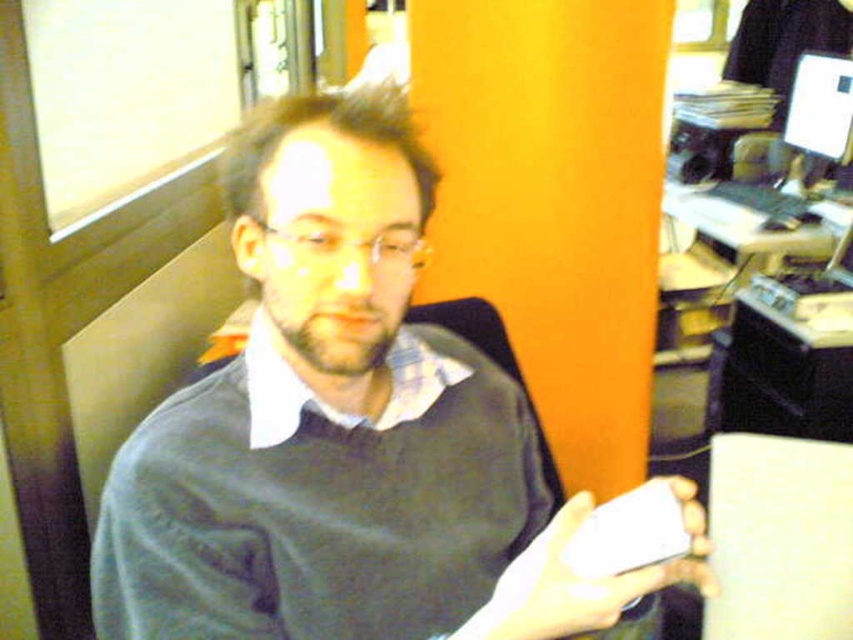
Is matte gray sweater at center positioned at the back of white matte phone at center?

Yes, it is.

Does point (300, 500) come behind point (531, 609)?

Yes, it is.

What do you see at coordinates (341, 433) in the screenshot? The width and height of the screenshot is (853, 640). I see `matte gray sweater at center` at bounding box center [341, 433].

Identify the location of matte gray sweater at center. (341, 433).